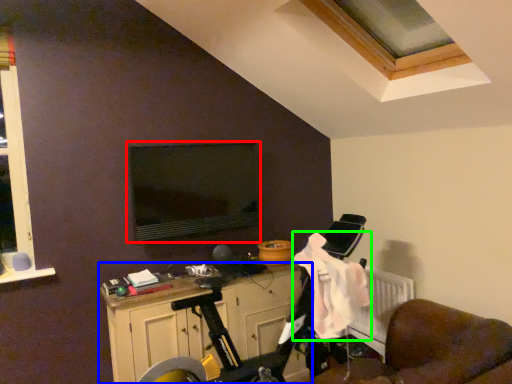
Question: Which object is positioned farthest from computer monitor (highlighted by a red box)? Select from cabinetry (highlighted by a blue box) and laundry (highlighted by a green box).

Choices:
 (A) cabinetry
 (B) laundry

Answer: (B)